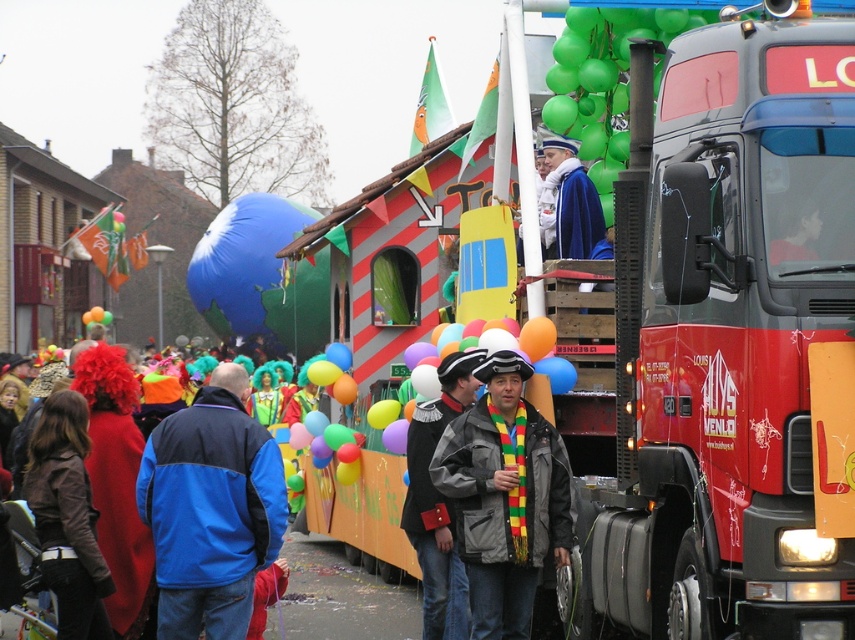
Looking at this image, between gray matte jacket at center and blue glossy balloon at center, which one appears on the left side from the viewer's perspective?

From the viewer's perspective, blue glossy balloon at center appears more on the left side.

Can you confirm if gray matte jacket at center is positioned above blue glossy balloon at center?

Actually, gray matte jacket at center is below blue glossy balloon at center.

Identify the location of gray matte jacket at center. Image resolution: width=855 pixels, height=640 pixels. (504, 497).

This screenshot has width=855, height=640. Find the location of `gray matte jacket at center`. gray matte jacket at center is located at coordinates (504, 497).

Can you confirm if red matte truck at center is positioned to the left of velvet black hat at center?

No, red matte truck at center is not to the left of velvet black hat at center.

Which is above, red matte truck at center or velvet black hat at center?

red matte truck at center is higher up.

What do you see at coordinates (676, 326) in the screenshot?
I see `red matte truck at center` at bounding box center [676, 326].

Identify the location of red matte truck at center. The height and width of the screenshot is (640, 855). (676, 326).

Between brown leather jacket at lower left and velvet black hat at center, which one has less height?

brown leather jacket at lower left is shorter.

Is brown leather jacket at lower left to the right of velvet black hat at center from the viewer's perspective?

Incorrect, brown leather jacket at lower left is not on the right side of velvet black hat at center.

Is point (55, 518) positioned after point (443, 365)?

No.

Find the location of `brown leather jacket at lower left`. brown leather jacket at lower left is located at coordinates (68, 516).